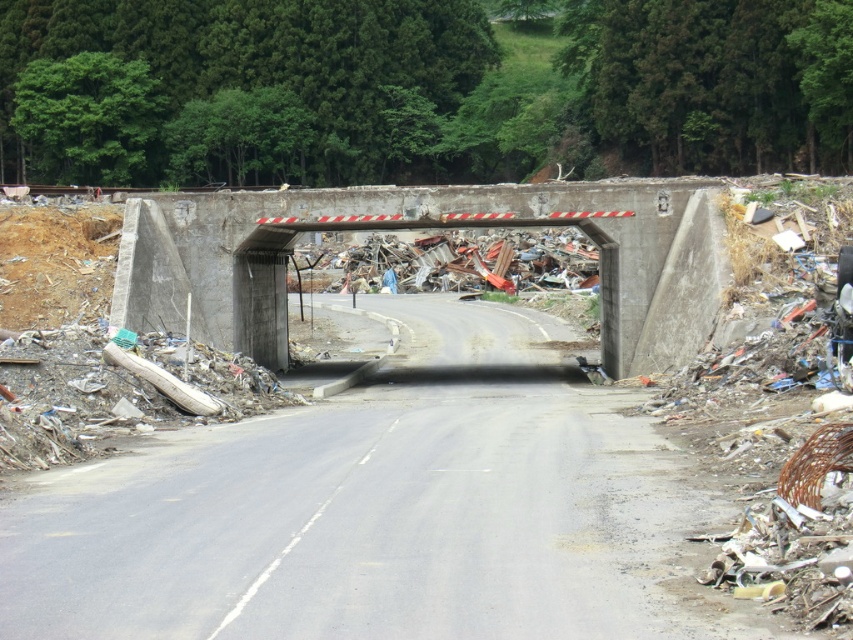
Question: Observing the image, what is the correct spatial positioning of asphalt road at center in reference to concrete bridge at center?

Choices:
 (A) above
 (B) below

Answer: (B)

Question: Does asphalt road at center have a larger size compared to concrete bridge at center?

Choices:
 (A) no
 (B) yes

Answer: (A)

Question: Which point is closer to the camera?

Choices:
 (A) asphalt road at center
 (B) concrete bridge at center

Answer: (A)

Question: Which point is closer to the camera?

Choices:
 (A) asphalt road at center
 (B) concrete bridge at center

Answer: (A)

Question: Does asphalt road at center appear over concrete bridge at center?

Choices:
 (A) no
 (B) yes

Answer: (A)